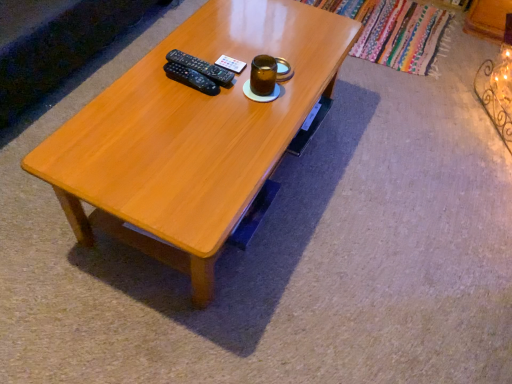
Question: Is light brown wood coffee table at center wider than black plastic remote at center?

Choices:
 (A) yes
 (B) no

Answer: (A)

Question: Is light brown wood coffee table at center positioned with its back to black plastic remote at center?

Choices:
 (A) no
 (B) yes

Answer: (A)

Question: Is light brown wood coffee table at center further to the viewer compared to black plastic remote at center?

Choices:
 (A) no
 (B) yes

Answer: (A)

Question: From the image's perspective, is light brown wood coffee table at center on top of black plastic remote at center?

Choices:
 (A) no
 (B) yes

Answer: (A)

Question: From a real-world perspective, is light brown wood coffee table at center below black plastic remote at center?

Choices:
 (A) no
 (B) yes

Answer: (B)

Question: Would you say black plastic remote at center is inside or outside light brown wood coffee table at center?

Choices:
 (A) inside
 (B) outside

Answer: (A)

Question: Considering their positions, is black plastic remote at center located in front of or behind light brown wood coffee table at center?

Choices:
 (A) behind
 (B) front

Answer: (A)

Question: From the image's perspective, is black plastic remote at center located above or below light brown wood coffee table at center?

Choices:
 (A) below
 (B) above

Answer: (B)

Question: Is point (185, 64) closer or farther from the camera than point (250, 102)?

Choices:
 (A) farther
 (B) closer

Answer: (A)

Question: From the image's perspective, is brown glass jar at upper center located above or below black plastic remote at center?

Choices:
 (A) above
 (B) below

Answer: (B)

Question: Is point pyautogui.click(x=254, y=94) closer or farther from the camera than point pyautogui.click(x=228, y=76)?

Choices:
 (A) closer
 (B) farther

Answer: (A)

Question: Do you think brown glass jar at upper center is within black plastic remote at center, or outside of it?

Choices:
 (A) outside
 (B) inside

Answer: (A)

Question: Based on their positions, is brown glass jar at upper center located to the left or right of black plastic remote at center?

Choices:
 (A) right
 (B) left

Answer: (A)

Question: From a real-world perspective, relative to black plastic remote at center, is light brown wood coffee table at center vertically above or below?

Choices:
 (A) above
 (B) below

Answer: (B)

Question: In the image, is light brown wood coffee table at center positioned in front of or behind black plastic remote at center?

Choices:
 (A) front
 (B) behind

Answer: (A)